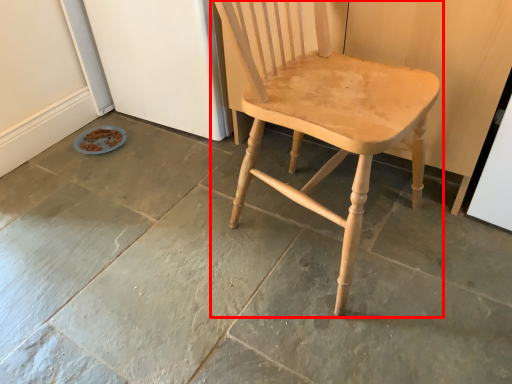
Question: Observing the image, what is the correct spatial positioning of chair (annotated by the red box) in reference to concrete?

Choices:
 (A) right
 (B) left

Answer: (A)